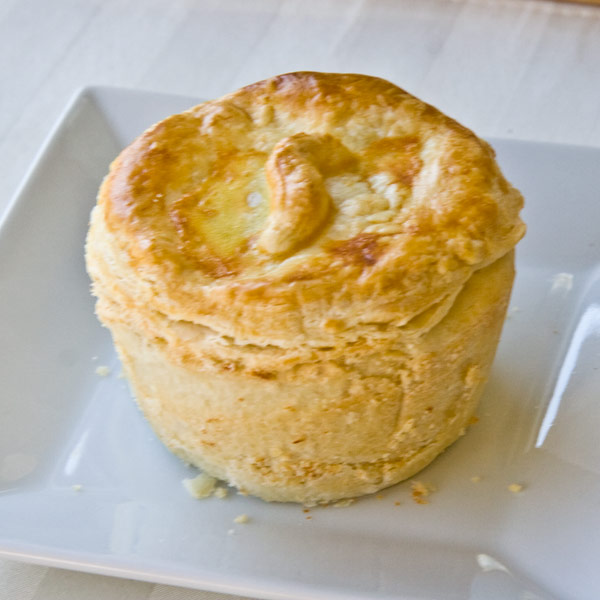
This screenshot has height=600, width=600. I want to click on crumbs that fell on the plate, so click(203, 485), click(104, 376), click(241, 517), click(423, 493), click(477, 480), click(516, 489).